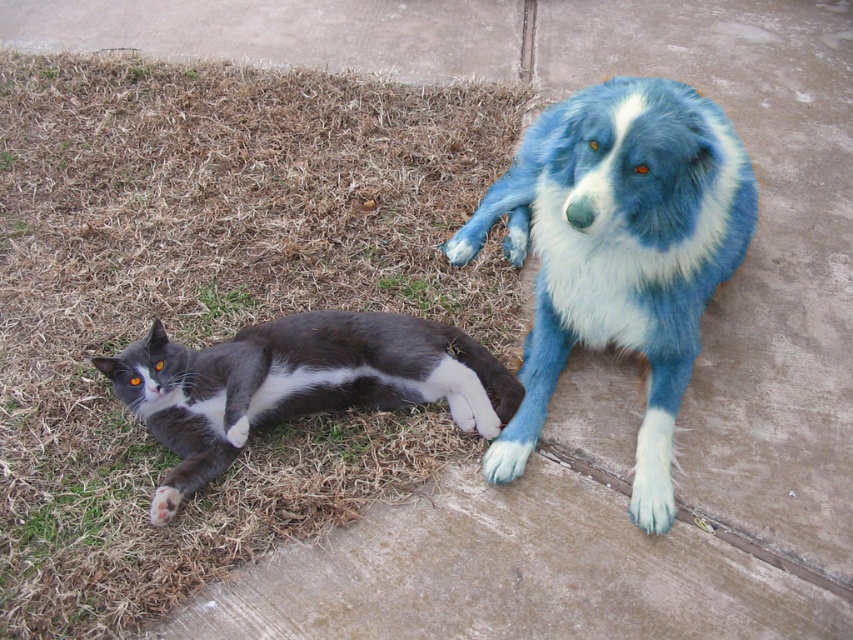
Question: Can you confirm if green grass at lower left is positioned to the left of gray-white fur cat at lower left?

Choices:
 (A) yes
 (B) no

Answer: (A)

Question: Is blue fluffy dog at upper right wider than gray-white fur cat at lower left?

Choices:
 (A) no
 (B) yes

Answer: (A)

Question: Does blue fluffy dog at upper right have a larger size compared to gray-white fur cat at lower left?

Choices:
 (A) no
 (B) yes

Answer: (B)

Question: Which point is farther from the camera taking this photo?

Choices:
 (A) (289, 355)
 (B) (53, 234)
 (C) (648, 404)

Answer: (B)

Question: Considering the real-world distances, which object is farthest from the gray-white fur cat at lower left?

Choices:
 (A) green grass at lower left
 (B) blue fluffy dog at upper right

Answer: (A)

Question: Which object is closer to the camera taking this photo?

Choices:
 (A) green grass at lower left
 (B) blue fluffy dog at upper right
 (C) gray-white fur cat at lower left

Answer: (A)